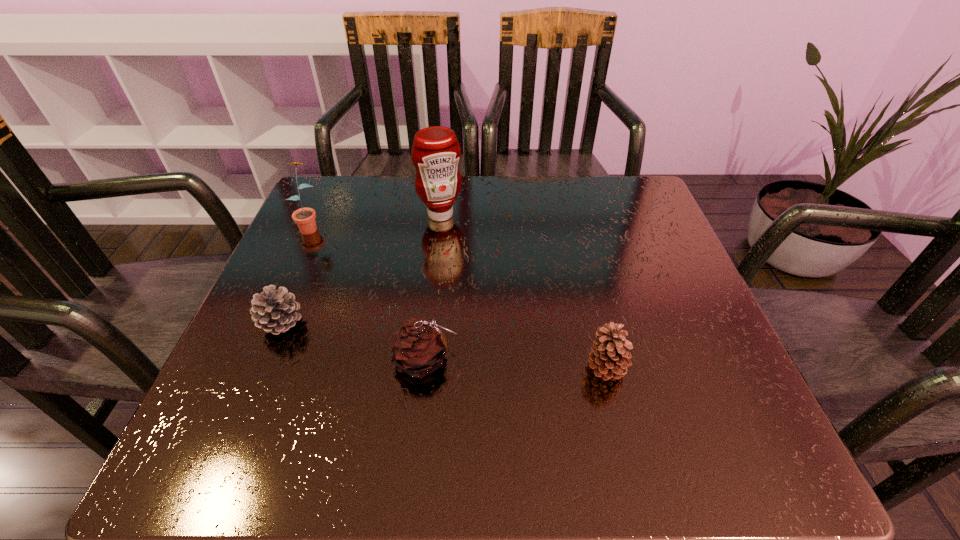
Find the location of a particular element. Image resolution: width=960 pixels, height=540 pixels. the tallest object is located at coordinates (436, 152).

The width and height of the screenshot is (960, 540). I want to click on the second tallest object, so click(x=305, y=217).

Locate an element on the screen. The height and width of the screenshot is (540, 960). the rightmost pinecone is located at coordinates (609, 358).

Identify the location of the second pinecone from left to right. (419, 347).

Image resolution: width=960 pixels, height=540 pixels. I want to click on the shortest object, so click(273, 310).

Find the location of `the leftmost pinecone`. the leftmost pinecone is located at coordinates (273, 310).

I want to click on free space located 0.100m on the front of the tallest object, so [437, 252].

Locate an element on the screen. free space located 0.250m on the flower of the sunflower is located at coordinates (268, 319).

Locate an element on the screen. free space located on the back of the rightmost pinecone is located at coordinates (574, 237).

Identify the location of free space located 0.340m with a leaf charm attached to the second pinecone from right to left. (655, 360).